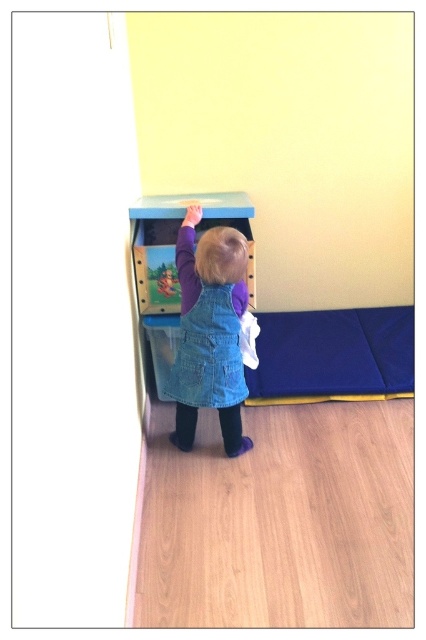
Question: Can you confirm if denim dress at center is wider than denim overalls at center?

Choices:
 (A) no
 (B) yes

Answer: (B)

Question: Which object is farther from the camera taking this photo?

Choices:
 (A) denim overalls at center
 (B) denim dress at center

Answer: (A)

Question: Can you confirm if denim dress at center is positioned to the left of denim overalls at center?

Choices:
 (A) yes
 (B) no

Answer: (A)

Question: Considering the relative positions of denim dress at center and denim overalls at center in the image provided, where is denim dress at center located with respect to denim overalls at center?

Choices:
 (A) left
 (B) right

Answer: (A)

Question: Which of the following is the closest to the observer?

Choices:
 (A) (199, 360)
 (B) (242, 452)

Answer: (A)